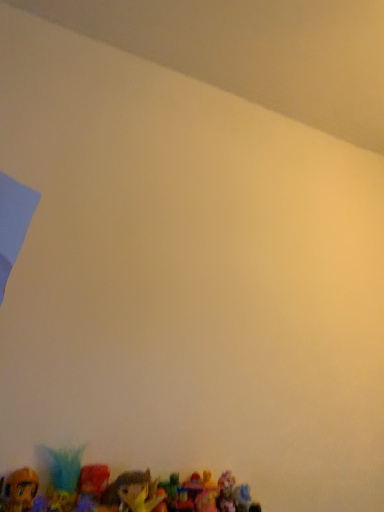
Question: In which direction should I rotate to look at plush toy at bottom, which is counted as the 2th toy, starting from the left?

Choices:
 (A) right
 (B) left

Answer: (B)

Question: Is shiny plastic toy at lower center, marked as the first toy in a right-to-left arrangement, located outside shiny plastic toy at lower left, the 1th toy positioned from the left?

Choices:
 (A) yes
 (B) no

Answer: (A)

Question: Is shiny plastic toy at lower center, marked as the first toy in a right-to-left arrangement, further to camera compared to shiny plastic toy at lower left, the 1th toy positioned from the left?

Choices:
 (A) no
 (B) yes

Answer: (A)

Question: Is shiny plastic toy at lower center, marked as the first toy in a right-to-left arrangement, smaller than shiny plastic toy at lower left, the 3th toy viewed from the right?

Choices:
 (A) no
 (B) yes

Answer: (A)

Question: Is shiny plastic toy at lower center, which is counted as the 3th toy, starting from the left, next to shiny plastic toy at lower left, the 3th toy viewed from the right?

Choices:
 (A) no
 (B) yes

Answer: (A)

Question: Considering the relative sizes of shiny plastic toy at lower center, which is counted as the 3th toy, starting from the left, and shiny plastic toy at lower left, the 3th toy viewed from the right, in the image provided, is shiny plastic toy at lower center, which is counted as the 3th toy, starting from the left, shorter than shiny plastic toy at lower left, the 3th toy viewed from the right,?

Choices:
 (A) no
 (B) yes

Answer: (B)

Question: Can you confirm if shiny plastic toy at lower center, which is counted as the 3th toy, starting from the left, is thinner than shiny plastic toy at lower left, the 1th toy positioned from the left?

Choices:
 (A) yes
 (B) no

Answer: (B)

Question: Is shiny plastic toy at lower left, the 1th toy positioned from the left, at the left side of shiny plastic toy at lower center, which is counted as the 3th toy, starting from the left?

Choices:
 (A) yes
 (B) no

Answer: (A)

Question: Considering the relative sizes of shiny plastic toy at lower left, the 1th toy positioned from the left, and shiny plastic toy at lower center, which is counted as the 3th toy, starting from the left, in the image provided, is shiny plastic toy at lower left, the 1th toy positioned from the left, wider than shiny plastic toy at lower center, which is counted as the 3th toy, starting from the left,?

Choices:
 (A) yes
 (B) no

Answer: (B)

Question: From a real-world perspective, does shiny plastic toy at lower left, the 1th toy positioned from the left, stand above shiny plastic toy at lower center, marked as the first toy in a right-to-left arrangement?

Choices:
 (A) yes
 (B) no

Answer: (A)

Question: Considering the relative sizes of shiny plastic toy at lower left, the 1th toy positioned from the left, and shiny plastic toy at lower center, marked as the first toy in a right-to-left arrangement, in the image provided, is shiny plastic toy at lower left, the 1th toy positioned from the left, thinner than shiny plastic toy at lower center, marked as the first toy in a right-to-left arrangement,?

Choices:
 (A) yes
 (B) no

Answer: (A)

Question: Can you confirm if shiny plastic toy at lower left, the 1th toy positioned from the left, is taller than shiny plastic toy at lower center, marked as the first toy in a right-to-left arrangement?

Choices:
 (A) no
 (B) yes

Answer: (B)

Question: Is shiny plastic toy at lower left, the 1th toy positioned from the left, next to shiny plastic toy at lower center, which is counted as the 3th toy, starting from the left?

Choices:
 (A) no
 (B) yes

Answer: (A)

Question: Is plush toy at bottom, the second toy viewed from the right, turned away from shiny plastic toy at lower left, the 3th toy viewed from the right?

Choices:
 (A) yes
 (B) no

Answer: (B)